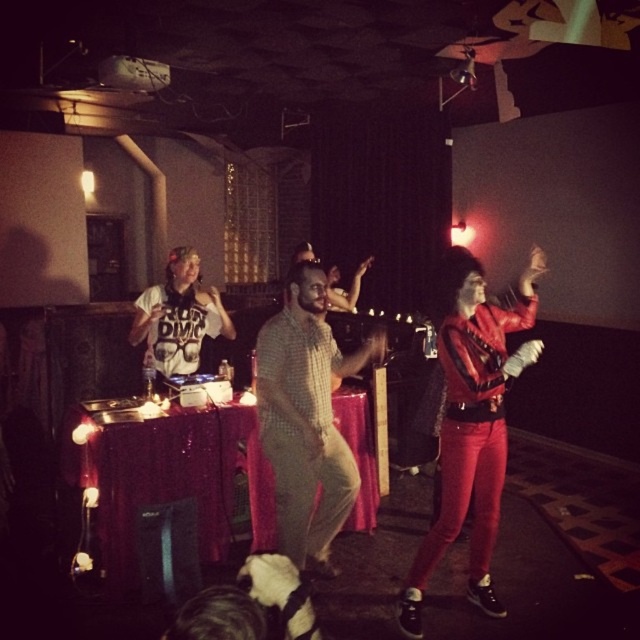
Question: Which of the following is the farthest from the observer?

Choices:
 (A) (122, 528)
 (B) (172, 358)
 (C) (323, 296)
 (D) (499, 483)

Answer: (B)

Question: Which point is closer to the camera?

Choices:
 (A) matte black t-shirt at center
 (B) shiny red leather jacket at right
 (C) shiny red tablecloth at center

Answer: (B)

Question: Which point is closer to the camera?

Choices:
 (A) shiny red tablecloth at center
 (B) shiny red leather jacket at right

Answer: (B)

Question: Can you confirm if shiny red leather jacket at right is thinner than matte black t-shirt at center?

Choices:
 (A) no
 (B) yes

Answer: (A)

Question: Observing the image, what is the correct spatial positioning of shiny red tablecloth at center in reference to checkered fabric shirt at center?

Choices:
 (A) left
 (B) right

Answer: (A)

Question: Does shiny red tablecloth at center have a larger size compared to matte black t-shirt at center?

Choices:
 (A) no
 (B) yes

Answer: (B)